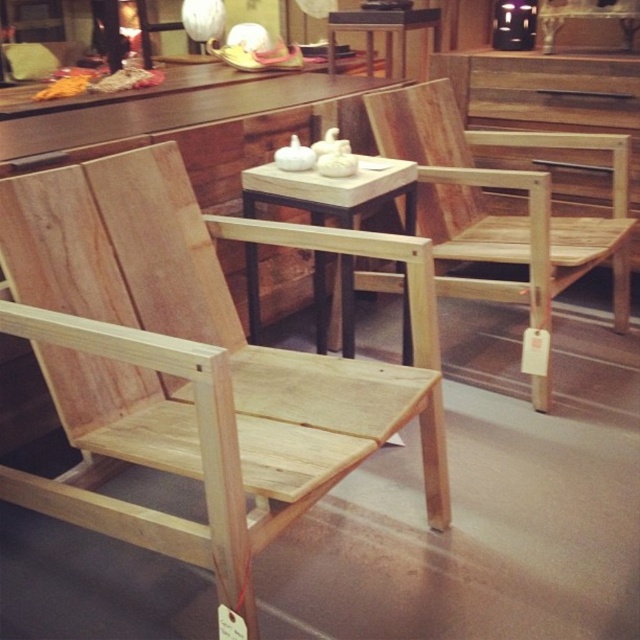
Does natural wood chair at center have a lesser width compared to wooden table at center?

In fact, natural wood chair at center might be wider than wooden table at center.

The image size is (640, 640). What are the coordinates of `natural wood chair at center` in the screenshot? It's located at (500, 216).

Is point (321, 248) less distant than point (570, 260)?

That is True.

What do you see at coordinates (225, 321) in the screenshot? I see `natural wood chair at left` at bounding box center [225, 321].

Is point (38, 353) positioned behind point (506, 220)?

No.

I want to click on natural wood chair at left, so click(x=225, y=321).

Can you confirm if light wood table at center is positioned below matte white lampshade at upper center?

Result: Yes.

Locate an element on the screen. light wood table at center is located at coordinates (332, 192).

Locate an element on the screen. light wood table at center is located at coordinates (332, 192).